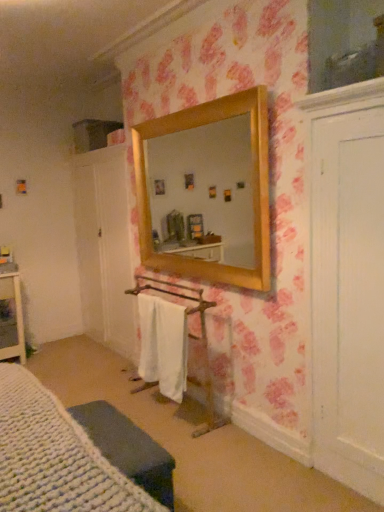
What is the approximate width of knitted fabric cushion at lower left?

The width of knitted fabric cushion at lower left is 11.14 inches.

Where is `white knitted bed at lower left`? white knitted bed at lower left is located at coordinates (55, 456).

Locate an element on the screen. This screenshot has width=384, height=512. white cotton bath towel at center is located at coordinates (163, 345).

Measure the distance between point [169,390] and camera.

Point [169,390] and camera are 9.66 feet apart.

The width and height of the screenshot is (384, 512). I want to click on knitted fabric cushion at lower left, so click(x=128, y=449).

Is knitted fabric cushion at lower left looking in the opposite direction of white knitted bed at lower left?

That's not correct — knitted fabric cushion at lower left is not looking away from white knitted bed at lower left.

Can you confirm if knitted fabric cushion at lower left is positioned to the left of white knitted bed at lower left?

In fact, knitted fabric cushion at lower left is to the right of white knitted bed at lower left.

Does knitted fabric cushion at lower left come behind white knitted bed at lower left?

Yes.

This screenshot has width=384, height=512. Find the location of `bed located in front of the knitted fabric cushion at lower left`. bed located in front of the knitted fabric cushion at lower left is located at coordinates (55, 456).

Is white cotton bath towel at center far from white knitted bed at lower left?

Yes, white cotton bath towel at center and white knitted bed at lower left are located far from each other.

In the image, is white cotton bath towel at center on the left side or the right side of white knitted bed at lower left?

Based on their positions, white cotton bath towel at center is located to the right of white knitted bed at lower left.

Can you confirm if white cotton bath towel at center is thinner than white knitted bed at lower left?

Indeed, white cotton bath towel at center has a lesser width compared to white knitted bed at lower left.

Could you tell me if white knitted bed at lower left is facing knitted fabric cushion at lower left?

No, white knitted bed at lower left is not facing towards knitted fabric cushion at lower left.

Is white knitted bed at lower left far away from knitted fabric cushion at lower left?

That's not correct — white knitted bed at lower left is a little close to knitted fabric cushion at lower left.

How distant is white knitted bed at lower left from knitted fabric cushion at lower left?

white knitted bed at lower left is 13.13 inches from knitted fabric cushion at lower left.

From the image's perspective, is white knitted bed at lower left positioned above or below knitted fabric cushion at lower left?

white knitted bed at lower left is situated higher than knitted fabric cushion at lower left in the image.

Can you confirm if white knitted bed at lower left is shorter than white cotton bath towel at center?

Indeed, white knitted bed at lower left has a lesser height compared to white cotton bath towel at center.

Which object is thinner, white knitted bed at lower left or white cotton bath towel at center?

white cotton bath towel at center.

Is white knitted bed at lower left positioned beyond the bounds of white cotton bath towel at center?

Indeed, white knitted bed at lower left is completely outside white cotton bath towel at center.

From a real-world perspective, does white knitted bed at lower left stand above white cotton bath towel at center?

Correct, in the physical world, white knitted bed at lower left is higher than white cotton bath towel at center.

Between white cotton bath towel at center and knitted fabric cushion at lower left, which one appears on the right side from the viewer's perspective?

From the viewer's perspective, white cotton bath towel at center appears more on the right side.

Who is taller, white cotton bath towel at center or knitted fabric cushion at lower left?

With more height is white cotton bath towel at center.

Is white cotton bath towel at center thinner than knitted fabric cushion at lower left?

Correct, the width of white cotton bath towel at center is less than that of knitted fabric cushion at lower left.

Are white cotton bath towel at center and knitted fabric cushion at lower left far apart?

No, white cotton bath towel at center is not far away from knitted fabric cushion at lower left.

Would you consider knitted fabric cushion at lower left to be distant from white cotton bath towel at center?

That's not correct — knitted fabric cushion at lower left is a little close to white cotton bath towel at center.

Based on the photo, can you confirm if knitted fabric cushion at lower left is shorter than white cotton bath towel at center?

Yes.

Is knitted fabric cushion at lower left outside of white cotton bath towel at center?

Absolutely, knitted fabric cushion at lower left is external to white cotton bath towel at center.

Identify the location of furniture below the white knitted bed at lower left (from the image's perspective). pyautogui.click(x=128, y=449).

Locate an element on the screen. bath towel below the white knitted bed at lower left (from a real-world perspective) is located at coordinates click(163, 345).

Looking at the image, which one is located closer to knitted fabric cushion at lower left, white knitted bed at lower left or white cotton bath towel at center?

white knitted bed at lower left lies closer to knitted fabric cushion at lower left than the other object.

When comparing their distances from knitted fabric cushion at lower left, does white cotton bath towel at center or white knitted bed at lower left seem closer?

white knitted bed at lower left.

From the image, which object appears to be nearer to white knitted bed at lower left, white cotton bath towel at center or knitted fabric cushion at lower left?

knitted fabric cushion at lower left lies closer to white knitted bed at lower left than the other object.

Based on their spatial positions, is knitted fabric cushion at lower left or white cotton bath towel at center further from white knitted bed at lower left?

The object further to white knitted bed at lower left is white cotton bath towel at center.

Which object lies nearer to the anchor point white cotton bath towel at center, knitted fabric cushion at lower left or white knitted bed at lower left?

knitted fabric cushion at lower left lies closer to white cotton bath towel at center than the other object.

Which object lies further to the anchor point white cotton bath towel at center, white knitted bed at lower left or knitted fabric cushion at lower left?

Based on the image, white knitted bed at lower left appears to be further to white cotton bath towel at center.

Where is `furniture positioned between white knitted bed at lower left and white cotton bath towel at center from near to far`? This screenshot has width=384, height=512. furniture positioned between white knitted bed at lower left and white cotton bath towel at center from near to far is located at coordinates (x=128, y=449).